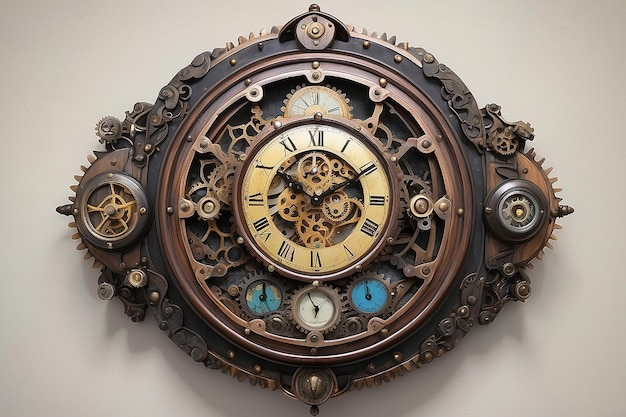
Identify the location of wall. The width and height of the screenshot is (626, 417). (79, 26), (568, 127).